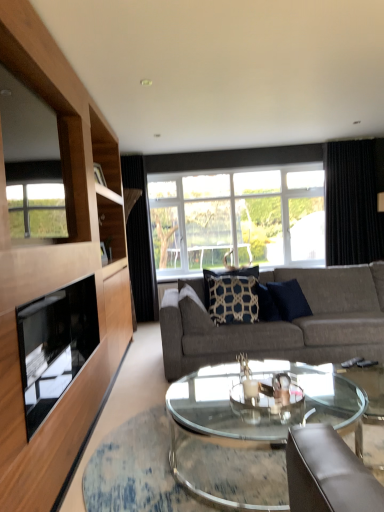
Question: From the image's perspective, is black textured curtain at center, placed as the first curtain when sorted from left to right, located above or below transparent glass coffee table at center?

Choices:
 (A) above
 (B) below

Answer: (A)

Question: From their relative heights in the image, would you say black textured curtain at center, placed as the first curtain when sorted from left to right, is taller or shorter than transparent glass coffee table at center?

Choices:
 (A) tall
 (B) short

Answer: (A)

Question: Which of these objects is positioned farthest from the black glass fireplace at left?

Choices:
 (A) black fabric curtain at right, positioned as the second curtain in left-to-right order
 (B) dark blue textured pillow at center, acting as the second pillow starting from the left
 (C) transparent glass coffee table at center
 (D) black textured curtain at center, placed as the first curtain when sorted from left to right
 (E) transparent glass window at center

Answer: (A)

Question: Which object is the farthest from the gray fabric couch at center?

Choices:
 (A) black glass fireplace at left
 (B) black textured curtain at center, placed as the first curtain when sorted from left to right
 (C) dark blue textured pillow at center, the first pillow when ordered from right to left
 (D) black fabric curtain at right, which appears as the 1th curtain when viewed from the right
 (E) transparent glass coffee table at center

Answer: (B)